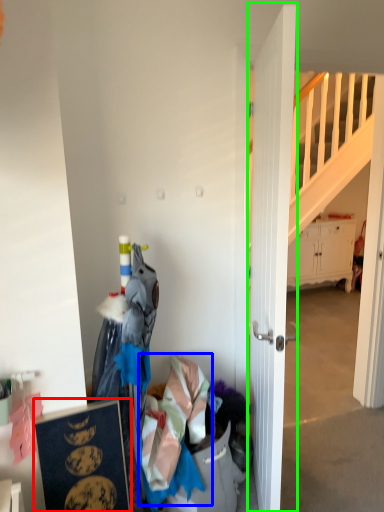
Question: Which is farther away from picture frame (highlighted by a red box)? clothing (highlighted by a blue box) or door (highlighted by a green box)?

Choices:
 (A) clothing
 (B) door

Answer: (B)